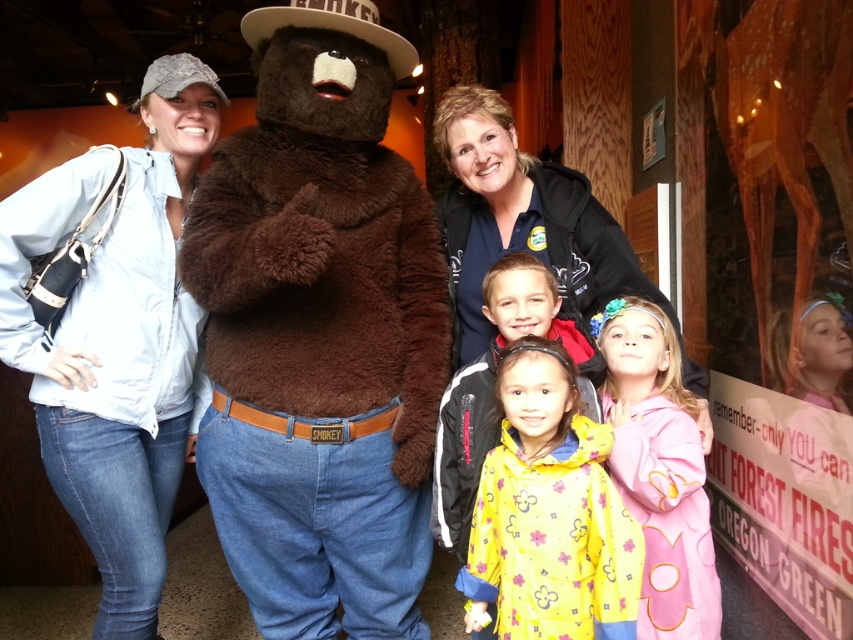
Is fuzzy brown bear at center to the right of yellow fabric raincoat at lower center from the viewer's perspective?

Incorrect, fuzzy brown bear at center is not on the right side of yellow fabric raincoat at lower center.

Between fuzzy brown bear at center and yellow fabric raincoat at lower center, which one is positioned lower?

yellow fabric raincoat at lower center

Is point (430, 554) positioned before point (550, 609)?

No, (430, 554) is further to viewer.

This screenshot has width=853, height=640. I want to click on fuzzy brown bear at center, so click(318, 332).

Measure the distance between light blue denim jeans at left and yellow fabric at center.

light blue denim jeans at left and yellow fabric at center are 33.45 inches apart from each other.

Which is in front, point (157, 602) or point (473, 365)?

Positioned in front is point (157, 602).

At what (x,y) coordinates should I click in order to perform the action: click on light blue denim jeans at left. Please return your answer as a coordinate pair (x, y). Looking at the image, I should click on (117, 339).

This screenshot has width=853, height=640. Identify the location of light blue denim jeans at left. 117,339.

Is light blue denim jeans at left shorter than blue fleece jacket at upper center?

Incorrect, light blue denim jeans at left's height does not fall short of blue fleece jacket at upper center's.

Does light blue denim jeans at left appear on the right side of blue fleece jacket at upper center?

Incorrect, light blue denim jeans at left is not on the right side of blue fleece jacket at upper center.

Measure the distance between point (83,451) and camera.

Point (83,451) is 5.44 feet away from camera.

Locate an element on the screen. light blue denim jeans at left is located at coordinates (117, 339).